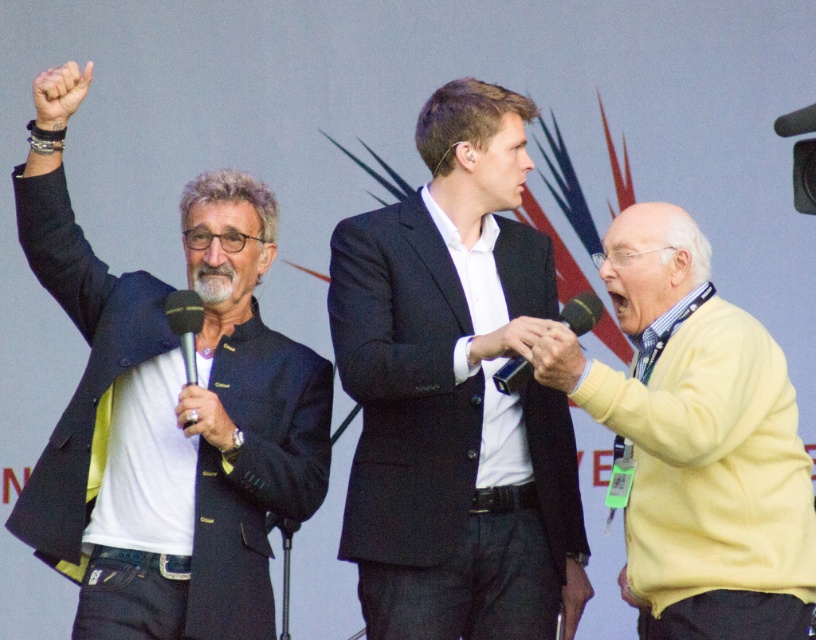
This screenshot has width=816, height=640. Describe the element at coordinates (706, 476) in the screenshot. I see `yellow sweater at right` at that location.

Who is positioned more to the left, yellow sweater at right or black matte microphone at left?

black matte microphone at left

Is point (672, 292) positioned before point (194, 385)?

No, (672, 292) is further to viewer.

The image size is (816, 640). Identify the location of yellow sweater at right. (706, 476).

From the picture: Which is more to the right, black suit jacket at center or matte black jacket at left?

From the viewer's perspective, black suit jacket at center appears more on the right side.

Does black suit jacket at center have a lesser height compared to matte black jacket at left?

In fact, black suit jacket at center may be taller than matte black jacket at left.

Which is in front, point (428, 451) or point (92, 321)?

Positioned in front is point (428, 451).

The height and width of the screenshot is (640, 816). Find the location of `black suit jacket at center`. black suit jacket at center is located at coordinates (455, 394).

Which is above, black suit jacket at center or yellow sweater at right?

Positioned higher is black suit jacket at center.

Can you confirm if black suit jacket at center is positioned below yellow sweater at right?

No, black suit jacket at center is not below yellow sweater at right.

Is point (435, 225) positioned before point (690, 497)?

No, it is not.

Locate an element on the screen. The image size is (816, 640). black suit jacket at center is located at coordinates (455, 394).